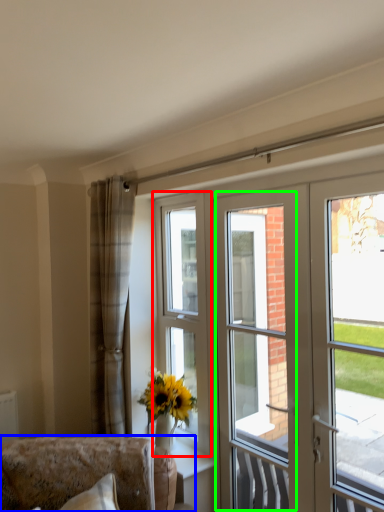
Question: Which is nearer to the window (highlighted by a red box)? furniture (highlighted by a blue box) or screen door (highlighted by a green box).

Choices:
 (A) furniture
 (B) screen door

Answer: (A)